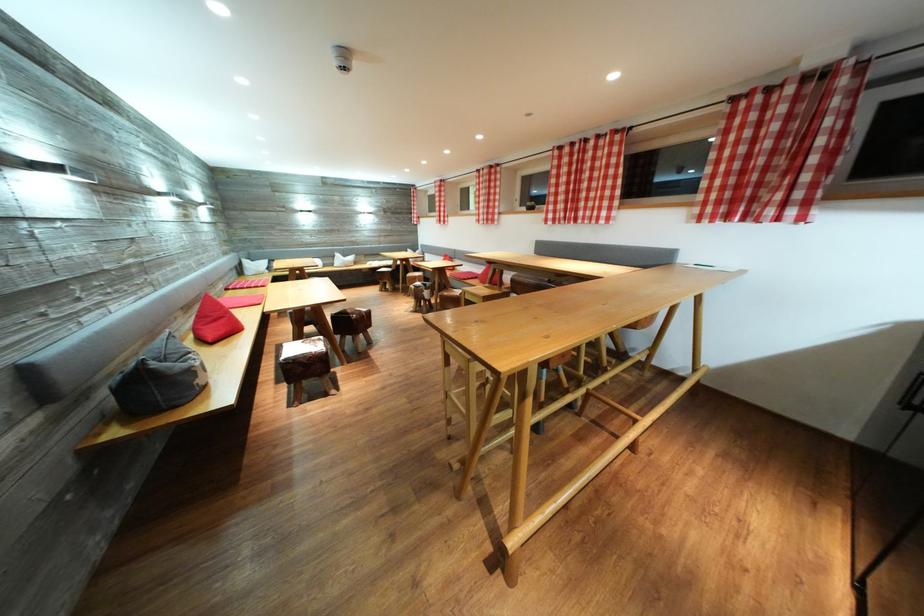
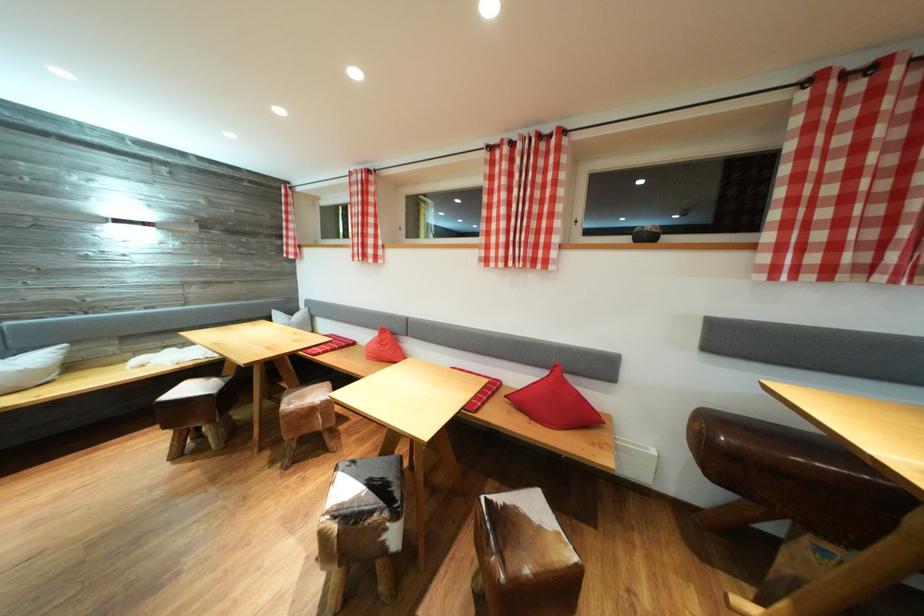
Locate, in the second image, the point that corresponds to the point at 566,153 in the first image.

(852, 81)